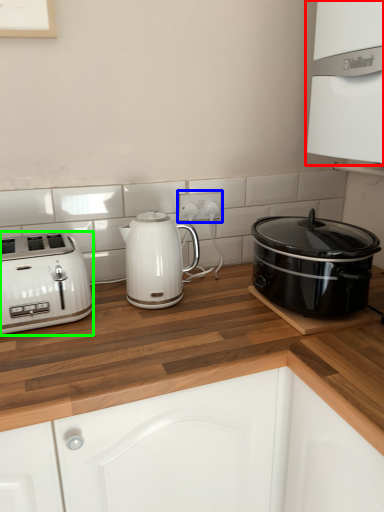
Question: Which object is positioned closest to oven (highlighted by a red box)? Select from electric outlet (highlighted by a blue box) and toaster (highlighted by a green box).

Choices:
 (A) electric outlet
 (B) toaster

Answer: (A)